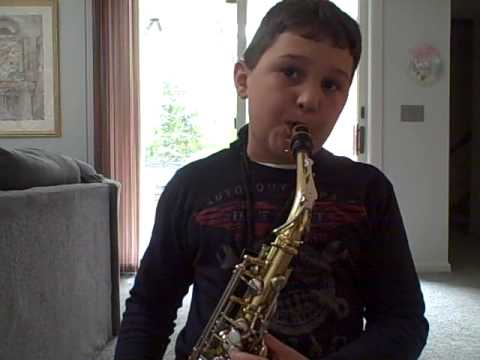
Where is `light`? light is located at coordinates (184, 63).